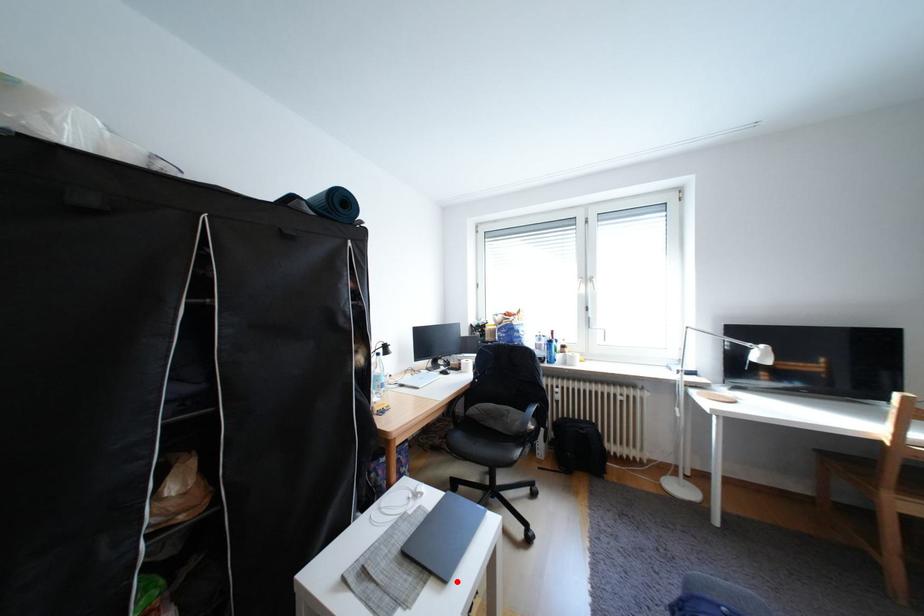
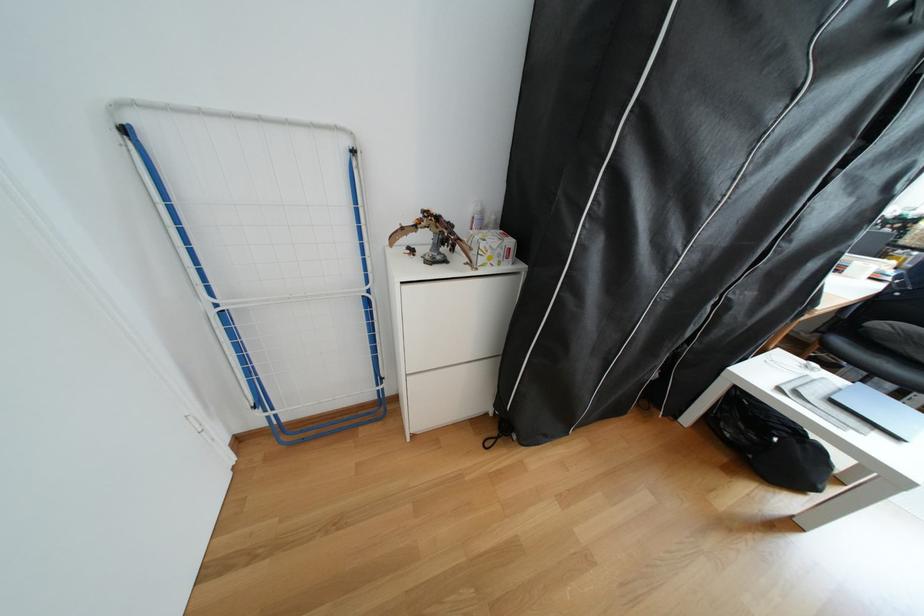
Question: I am providing you with two images of the same scene from different viewpoints. Image1 has a red point marked. In image2, the corresponding 3D location appears at what relative position? Reply with the corresponding letter.

Choices:
 (A) Closer
 (B) Farther

Answer: (A)